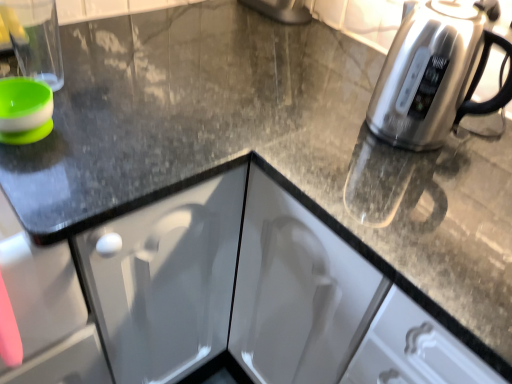
Question: From a real-world perspective, is satin silver kettle at right under transparent plastic cup at upper left?

Choices:
 (A) yes
 (B) no

Answer: (B)

Question: Is the depth of satin silver kettle at right less than that of transparent plastic cup at upper left?

Choices:
 (A) no
 (B) yes

Answer: (B)

Question: Is satin silver kettle at right wider than transparent plastic cup at upper left?

Choices:
 (A) yes
 (B) no

Answer: (A)

Question: Considering the relative sizes of satin silver kettle at right and transparent plastic cup at upper left in the image provided, is satin silver kettle at right thinner than transparent plastic cup at upper left?

Choices:
 (A) no
 (B) yes

Answer: (A)

Question: From the image's perspective, is satin silver kettle at right below transparent plastic cup at upper left?

Choices:
 (A) no
 (B) yes

Answer: (B)

Question: From a real-world perspective, does satin silver kettle at right stand above transparent plastic cup at upper left?

Choices:
 (A) no
 (B) yes

Answer: (B)

Question: Can you confirm if transparent plastic cup at upper left is taller than satin silver kettle at right?

Choices:
 (A) no
 (B) yes

Answer: (A)

Question: Can satin silver kettle at right be found inside transparent plastic cup at upper left?

Choices:
 (A) no
 (B) yes

Answer: (A)

Question: Is transparent plastic cup at upper left bigger than satin silver kettle at right?

Choices:
 (A) no
 (B) yes

Answer: (A)

Question: From the image's perspective, is transparent plastic cup at upper left over satin silver kettle at right?

Choices:
 (A) no
 (B) yes

Answer: (B)

Question: Is transparent plastic cup at upper left to the right of satin silver kettle at right from the viewer's perspective?

Choices:
 (A) no
 (B) yes

Answer: (A)

Question: Can you confirm if transparent plastic cup at upper left is shorter than satin silver kettle at right?

Choices:
 (A) yes
 (B) no

Answer: (A)

Question: From the image's perspective, is satin silver kettle at right positioned above or below transparent plastic cup at upper left?

Choices:
 (A) above
 (B) below

Answer: (B)